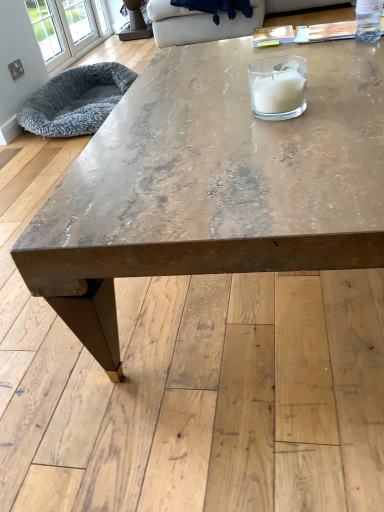
The width and height of the screenshot is (384, 512). In order to click on empty space that is to the right of white glass candle at upper center in this screenshot , I will do pyautogui.click(x=346, y=104).